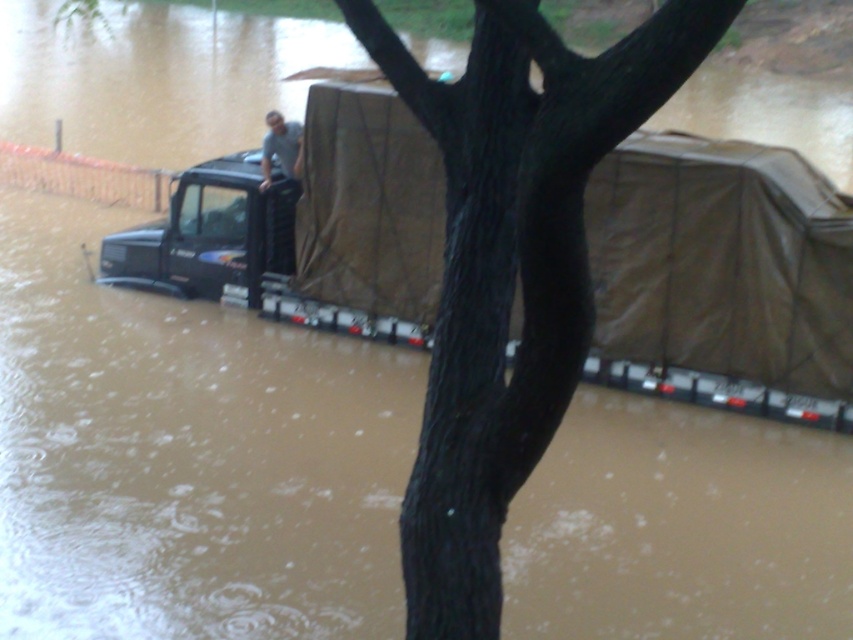
Question: Can you confirm if brown tarpaulin tent at center is thinner than gray fabric truck at center?

Choices:
 (A) yes
 (B) no

Answer: (B)

Question: Which object appears closest to the camera in this image?

Choices:
 (A) matte black truck at left
 (B) gray fabric truck at center

Answer: (B)

Question: Which point is closer to the camera?

Choices:
 (A) brown tarpaulin tent at center
 (B) gray fabric truck at center
 (C) matte black truck at left

Answer: (A)

Question: Does brown tarpaulin tent at center appear over matte black truck at left?

Choices:
 (A) no
 (B) yes

Answer: (A)

Question: Can you confirm if matte black truck at left is thinner than gray fabric truck at center?

Choices:
 (A) no
 (B) yes

Answer: (A)

Question: Among these objects, which one is nearest to the camera?

Choices:
 (A) matte black truck at left
 (B) gray fabric truck at center
 (C) brown tarpaulin tent at center

Answer: (C)